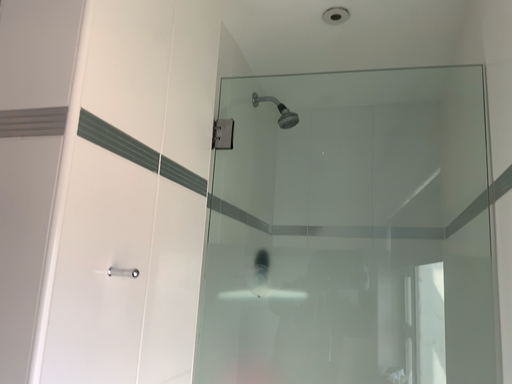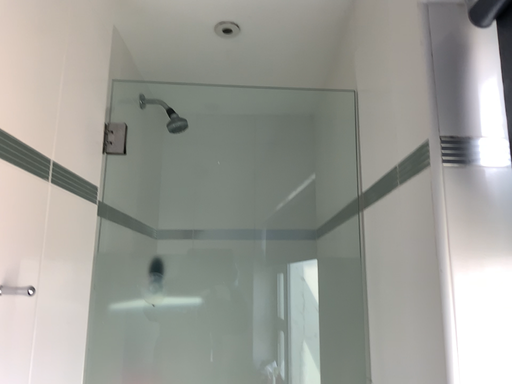
Question: How did the camera likely rotate when shooting the video?

Choices:
 (A) rotated left
 (B) rotated right

Answer: (B)